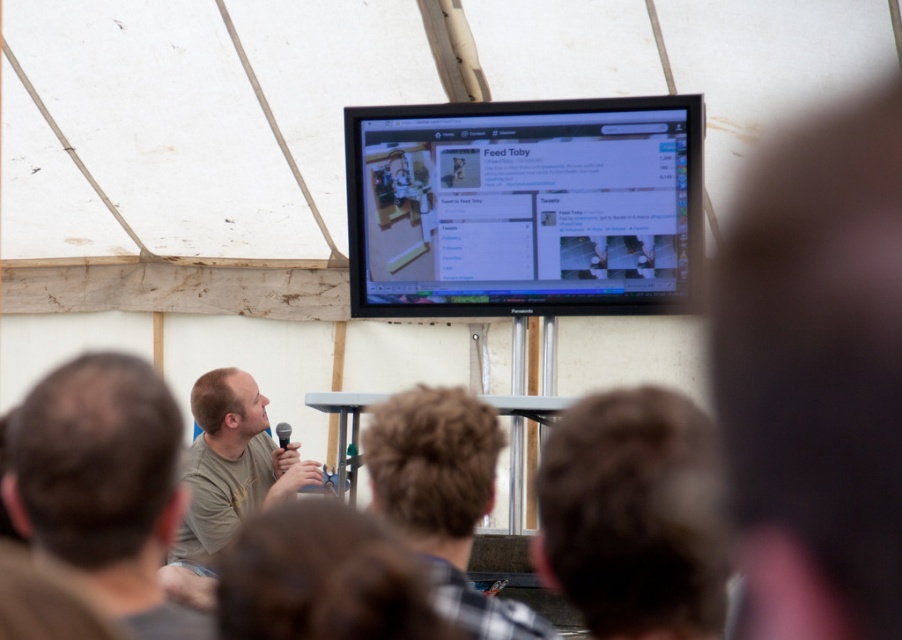
You are an attendee at this presentation. You notice the light brown hair at left and the black plastic microphone at upper center. Which object is wider?

The light brown hair at left is wider than the black plastic microphone at upper center.

In the scene shown: You are standing at the point labeled as point (x=152, y=376) and want to move to the point labeled as point (x=592, y=145). Which direction should you move in to reach your destination?

You should move forward to reach point (x=592, y=145) because it is behind point (x=152, y=376).

You are a photographer in the audience and want to take a photo of the speaker. You notice two audience members with light brown hair at left and brown hair at center. Which audience member is closer to the front of the audience?

The light brown hair at left has a lesser height compared to brown hair at center, so the light brown hair at left is closer to the front of the audience because being lower in height would mean they are positioned closer to the photographer.